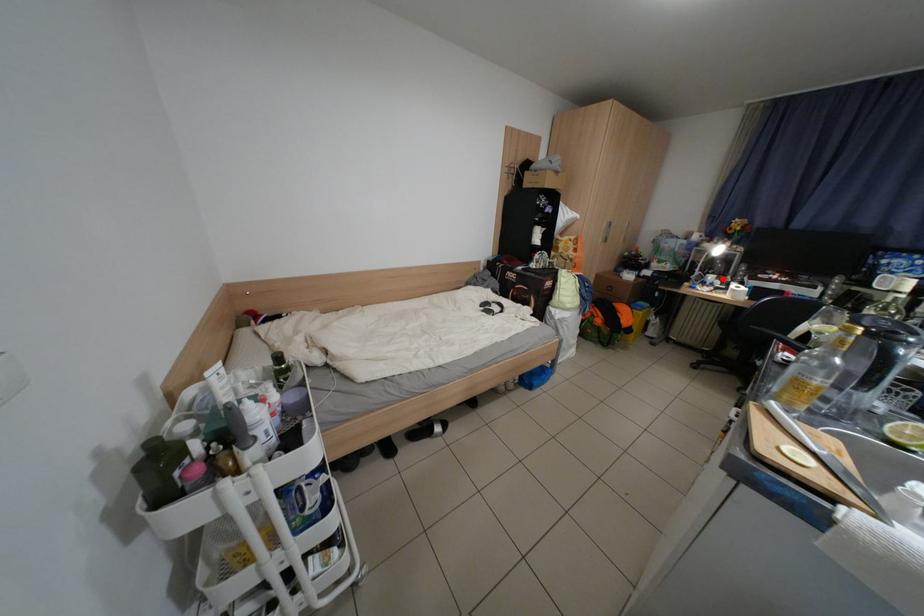
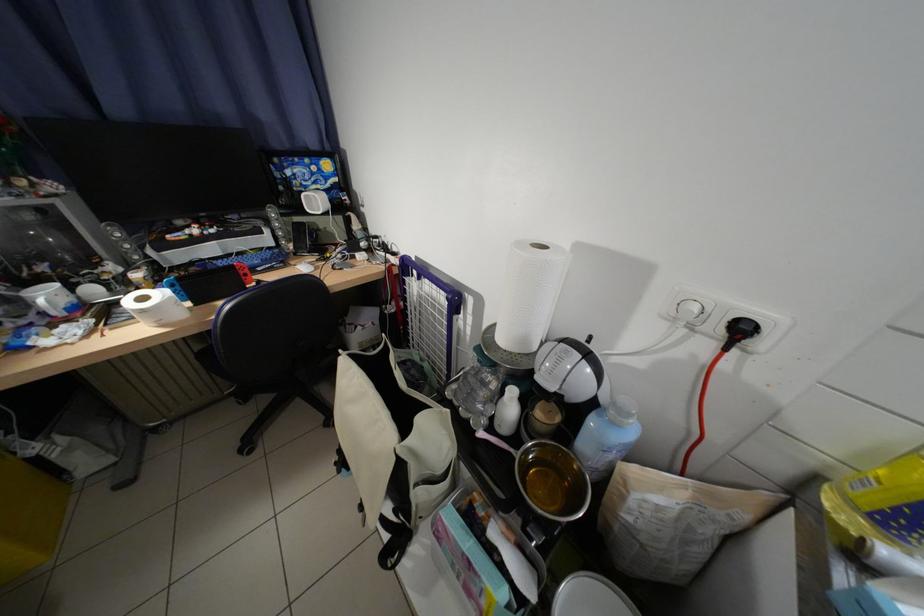
Question: I am providing you with two images of the same scene from different viewpoints. Image1 has a red point marked. In image2, the corresponding 3D location appears at what relative position? Reply with the corresponding letter.

Choices:
 (A) Closer
 (B) Farther

Answer: (B)